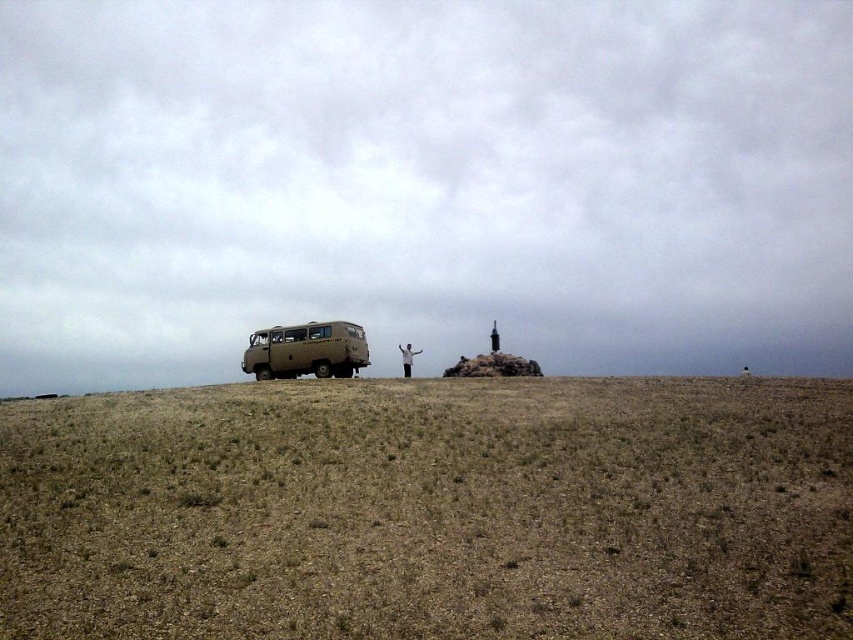
Question: From the image, what is the correct spatial relationship of brown dry grass at center in relation to white matte person at center?

Choices:
 (A) below
 (B) above

Answer: (A)

Question: Does brown dry grass at center appear on the left side of white matte person at center?

Choices:
 (A) no
 (B) yes

Answer: (A)

Question: Among these objects, which one is nearest to the camera?

Choices:
 (A) white matte person at center
 (B) beige matte van at left
 (C) brown dry grass at center

Answer: (C)

Question: Is brown dry grass at center closer to camera compared to white matte person at center?

Choices:
 (A) yes
 (B) no

Answer: (A)

Question: Which point is farther from the camera taking this photo?

Choices:
 (A) (345, 355)
 (B) (408, 360)

Answer: (B)

Question: Which of the following is the farthest from the observer?

Choices:
 (A) (379, 579)
 (B) (288, 339)
 (C) (413, 349)

Answer: (C)